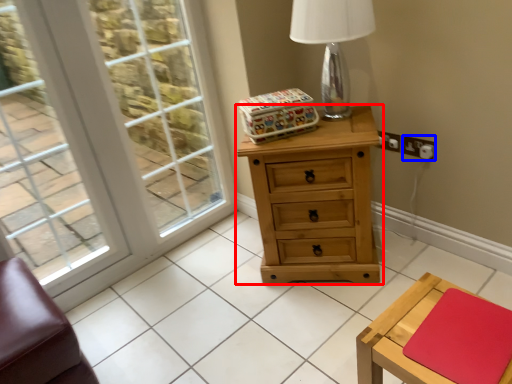
Question: Which point is further to the camera, chest of drawers (highlighted by a red box) or electric outlet (highlighted by a blue box)?

Choices:
 (A) chest of drawers
 (B) electric outlet

Answer: (B)